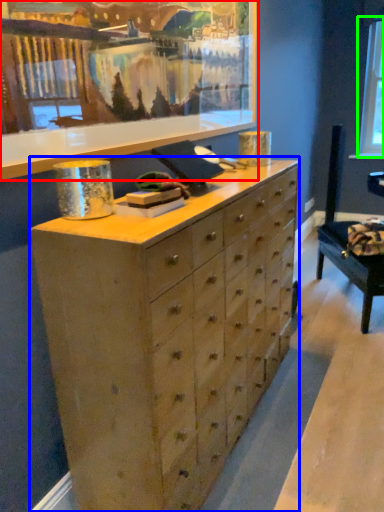
Question: Which is nearer to the picture frame (highlighted by a red box)? chest of drawers (highlighted by a blue box) or window screen (highlighted by a green box).

Choices:
 (A) chest of drawers
 (B) window screen

Answer: (A)